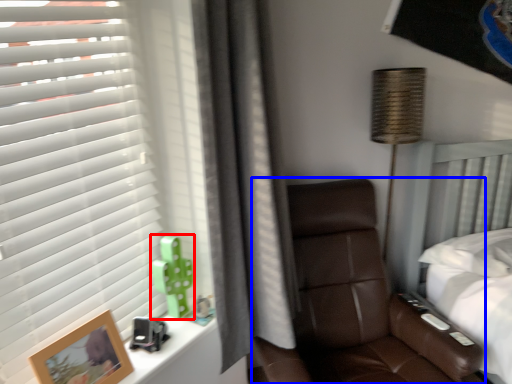
Question: Which of the following is the farthest to the observer, toy (highlighted by a red box) or chair (highlighted by a blue box)?

Choices:
 (A) toy
 (B) chair

Answer: (A)